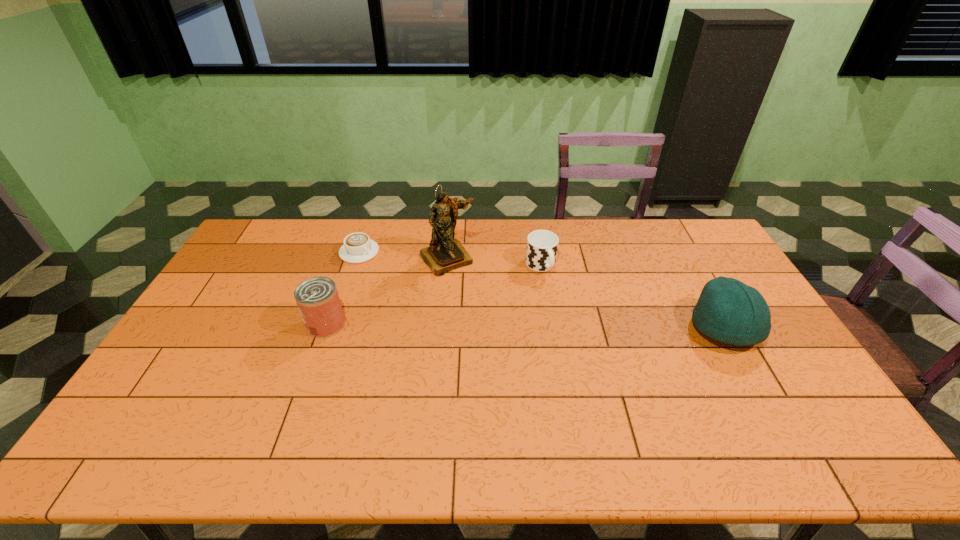
Where is `can`? can is located at coordinates (317, 298).

Locate an element on the screen. the rightmost object is located at coordinates (727, 310).

This screenshot has width=960, height=540. I want to click on the fourth tallest object, so click(542, 245).

Where is `cup`? cup is located at coordinates (542, 245).

Identify the location of the tallest object. (445, 253).

Where is `figurine`? The width and height of the screenshot is (960, 540). figurine is located at coordinates 445,253.

Identify the location of the shortest object. Image resolution: width=960 pixels, height=540 pixels. (358, 248).

Find the location of a particular element. The image size is (960, 540). vacant space situated on the front of the can is located at coordinates (295, 410).

What are the coordinates of `vacant space situated 0.050m on the left of the rightmost object` in the screenshot? It's located at (674, 328).

This screenshot has height=540, width=960. I want to click on vacant space situated 0.080m on the side of the cup with the handle, so click(x=558, y=294).